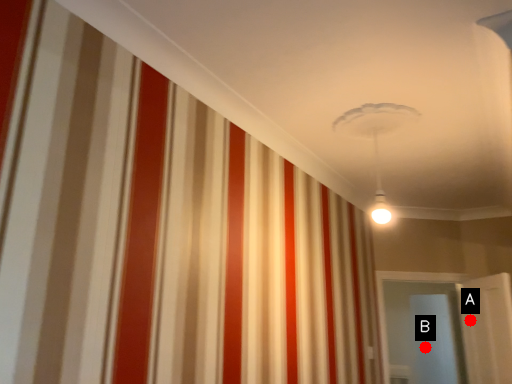
Question: Two points are circled on the image, labeled by A and B beside each circle. Which point appears closest to the camera in this image?

Choices:
 (A) A is closer
 (B) B is closer

Answer: (A)